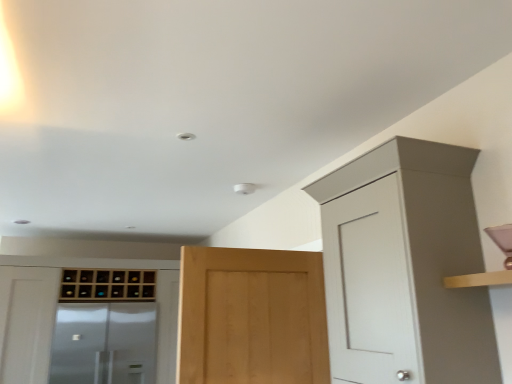
Question: Does light brown wood door at center lie behind matte white cabinet at upper right, the first cabinetry viewed from the front?

Choices:
 (A) yes
 (B) no

Answer: (A)

Question: Is matte white cabinet at upper right, the third cabinetry from the back, at the back of light brown wood door at center?

Choices:
 (A) yes
 (B) no

Answer: (A)

Question: From the image's perspective, is light brown wood door at center above matte white cabinet at upper right, placed as the third cabinetry when sorted from left to right?

Choices:
 (A) yes
 (B) no

Answer: (B)

Question: Considering the relative sizes of light brown wood door at center and matte white cabinet at upper right, which appears as the 1th cabinetry when viewed from the right, in the image provided, is light brown wood door at center wider than matte white cabinet at upper right, which appears as the 1th cabinetry when viewed from the right,?

Choices:
 (A) yes
 (B) no

Answer: (B)

Question: Is light brown wood door at center bigger than matte white cabinet at upper right, placed as the third cabinetry when sorted from left to right?

Choices:
 (A) no
 (B) yes

Answer: (A)

Question: Can you confirm if light brown wood door at center is smaller than matte white cabinet at upper right, which appears as the 1th cabinetry when viewed from the right?

Choices:
 (A) no
 (B) yes

Answer: (B)

Question: From a real-world perspective, is transparent glass screen door at lower left on wooden wine rack at left, acting as the 2th cabinetry starting from the back?

Choices:
 (A) no
 (B) yes

Answer: (A)

Question: Considering the relative sizes of transparent glass screen door at lower left and wooden wine rack at left, marked as the second cabinetry in a front-to-back arrangement, in the image provided, is transparent glass screen door at lower left taller than wooden wine rack at left, marked as the second cabinetry in a front-to-back arrangement,?

Choices:
 (A) no
 (B) yes

Answer: (A)

Question: Is transparent glass screen door at lower left further to camera compared to wooden wine rack at left, acting as the 2th cabinetry starting from the back?

Choices:
 (A) no
 (B) yes

Answer: (B)

Question: Does transparent glass screen door at lower left have a greater width compared to wooden wine rack at left, positioned as the third cabinetry in right-to-left order?

Choices:
 (A) no
 (B) yes

Answer: (A)

Question: Considering the relative sizes of transparent glass screen door at lower left and wooden wine rack at left, marked as the second cabinetry in a front-to-back arrangement, in the image provided, is transparent glass screen door at lower left smaller than wooden wine rack at left, marked as the second cabinetry in a front-to-back arrangement,?

Choices:
 (A) yes
 (B) no

Answer: (A)

Question: Does transparent glass screen door at lower left have a lesser width compared to wooden wine rack at left, acting as the 2th cabinetry starting from the back?

Choices:
 (A) no
 (B) yes

Answer: (B)

Question: Is the depth of transparent glass screen door at lower left greater than that of light brown wood door at center?

Choices:
 (A) no
 (B) yes

Answer: (B)